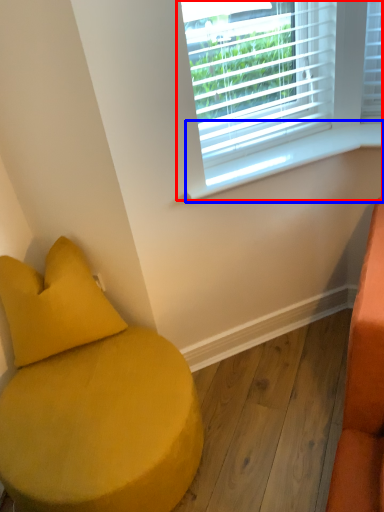
Question: Which object is further to the camera taking this photo, window (highlighted by a red box) or window sill (highlighted by a blue box)?

Choices:
 (A) window
 (B) window sill

Answer: (B)